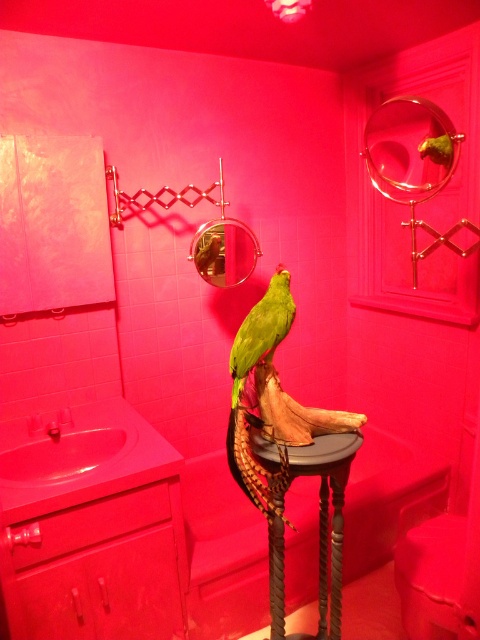
Question: Is wooden pedestal at center wider than green matte parrot at center?

Choices:
 (A) yes
 (B) no

Answer: (A)

Question: Is wooden pedestal at center thinner than green matte parrot at center?

Choices:
 (A) yes
 (B) no

Answer: (B)

Question: Which point is farther from the camera taking this photo?

Choices:
 (A) (334, 580)
 (B) (269, 312)

Answer: (A)

Question: Is wooden pedestal at center to the left of green matte parrot at center from the viewer's perspective?

Choices:
 (A) no
 (B) yes

Answer: (A)